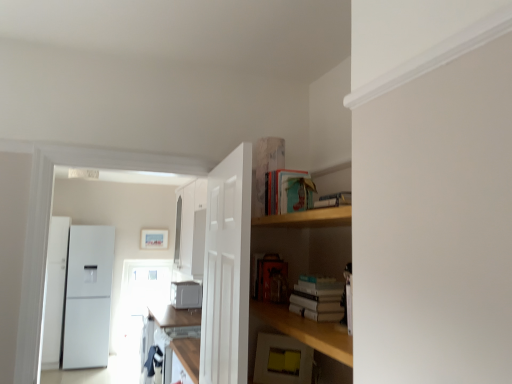
In order to face matte white cabinet at lower center, acting as the 2th cabinetry starting from the back, should I rotate leftwards or rightwards?

Rotate left and turn 10.445 degrees.

How much space does white matte book at center, which is counted as the 2th book, starting from the top, occupy horizontally?

7.42 inches.

You are a GUI agent. You are given a task and a screenshot of the screen. Output one action in this format:
    pyautogui.click(x=<x>, y=<y>)
    Task: Click on the white matte microwave at center, the first appliance ordered from the bottom
    
    Given the screenshot: What is the action you would take?
    pyautogui.click(x=186, y=295)

This screenshot has height=384, width=512. In order to click on matte wooden picture frame at upper center in this screenshot , I will do `click(154, 239)`.

Between white glossy cabinet at upper left, the first cabinetry viewed from the top, and matte wooden picture frame at upper center, which one has more height?

white glossy cabinet at upper left, the first cabinetry viewed from the top, is taller.

Does white glossy cabinet at upper left, which is the 2th cabinetry in front-to-back order, have a lesser width compared to matte wooden picture frame at upper center?

No, white glossy cabinet at upper left, which is the 2th cabinetry in front-to-back order, is not thinner than matte wooden picture frame at upper center.

Which of these two, white glossy cabinet at upper left, which is counted as the second cabinetry, starting from the bottom, or matte wooden picture frame at upper center, is bigger?

With larger size is white glossy cabinet at upper left, which is counted as the second cabinetry, starting from the bottom.

Is white glossy cabinet at upper left, which is the 2th cabinetry in front-to-back order, positioned with its back to matte wooden picture frame at upper center?

No.

From the image's perspective, is yellow matte sticky notes at lower center, placed as the second appliance when sorted from left to right, located above matte white cabinet at lower center, acting as the 2th cabinetry starting from the back?

Yes.

Is yellow matte sticky notes at lower center, which appears as the first appliance when viewed from the top, oriented away from matte white cabinet at lower center, the 2th cabinetry viewed from the top?

No, matte white cabinet at lower center, the 2th cabinetry viewed from the top, is not at the back of yellow matte sticky notes at lower center, which appears as the first appliance when viewed from the top.

Which is correct: yellow matte sticky notes at lower center, marked as the 1th appliance in a front-to-back arrangement, is inside matte white cabinet at lower center, acting as the 2th cabinetry starting from the back, or outside of it?

The correct answer is: outside.

In the scene shown: How many degrees apart are the facing directions of yellow matte sticky notes at lower center, which appears as the first appliance when viewed from the top, and matte white cabinet at lower center, acting as the 2th cabinetry starting from the back?

46.9 degrees separate the facing orientations of yellow matte sticky notes at lower center, which appears as the first appliance when viewed from the top, and matte white cabinet at lower center, acting as the 2th cabinetry starting from the back.

Which of these two, white glossy cabinet at upper left, which is the 2th cabinetry in front-to-back order, or white matte door at center, stands taller?

Standing taller between the two is white matte door at center.

Is white glossy cabinet at upper left, the first cabinetry viewed from the top, far from white matte door at center?

That's right, there is a large distance between white glossy cabinet at upper left, the first cabinetry viewed from the top, and white matte door at center.

Is white glossy cabinet at upper left, the first cabinetry viewed from the top, aimed at white matte door at center?

No, white glossy cabinet at upper left, the first cabinetry viewed from the top, is not facing towards white matte door at center.

Looking at this image, from their relative heights in the image, would you say white matte book at center, arranged as the 1th book when ordered from the bottom, is taller or shorter than white matte microwave at center, the 2th appliance positioned from the right?

Considering their sizes, white matte book at center, arranged as the 1th book when ordered from the bottom, has less height than white matte microwave at center, the 2th appliance positioned from the right.

This screenshot has height=384, width=512. Find the location of `the 2nd appliance located beneath the white matte book at center, which is counted as the 2th book, starting from the top (from a real-world perspective)`. the 2nd appliance located beneath the white matte book at center, which is counted as the 2th book, starting from the top (from a real-world perspective) is located at coordinates (186, 295).

Considering the relative positions of white matte book at center, which is counted as the 2th book, starting from the top, and white matte microwave at center, which is the first appliance from back to front, in the image provided, is white matte book at center, which is counted as the 2th book, starting from the top, to the left of white matte microwave at center, which is the first appliance from back to front, from the viewer's perspective?

Incorrect, white matte book at center, which is counted as the 2th book, starting from the top, is not on the left side of white matte microwave at center, which is the first appliance from back to front.

Looking at this image, can you tell me how much white matte book at center, which is counted as the 2th book, starting from the top, and white matte microwave at center, acting as the first appliance starting from the left, differ in facing direction?

0.000445 degrees.

Which of these two, teal matte book at upper center, which ranks as the second book in bottom-to-top order, or white matte microwave at center, the 2th appliance positioned from the right, is smaller?

With smaller size is teal matte book at upper center, which ranks as the second book in bottom-to-top order.

Is the surface of teal matte book at upper center, which ranks as the second book in bottom-to-top order, in direct contact with white matte microwave at center, the 2th appliance positioned from the right?

No.

Between point (283, 193) and point (186, 291), which one is positioned in front?

The point (283, 193) is in front.

From a real-world perspective, which object rests below the other?

In real-world perspective, white matte microwave at center, acting as the first appliance starting from the left, is lower.

In the image, is teal matte book at upper center, the 1th book viewed from the top, on the left side or the right side of yellow matte sticky notes at lower center, placed as the second appliance when sorted from left to right?

From the image, it's evident that teal matte book at upper center, the 1th book viewed from the top, is to the right of yellow matte sticky notes at lower center, placed as the second appliance when sorted from left to right.

Considering the relative sizes of teal matte book at upper center, the 1th book viewed from the top, and yellow matte sticky notes at lower center, arranged as the first appliance when viewed from the right, in the image provided, is teal matte book at upper center, the 1th book viewed from the top, shorter than yellow matte sticky notes at lower center, arranged as the first appliance when viewed from the right,?

Correct, teal matte book at upper center, the 1th book viewed from the top, is not as tall as yellow matte sticky notes at lower center, arranged as the first appliance when viewed from the right.

Considering the positions of point (279, 187) and point (263, 374), is point (279, 187) closer or farther from the camera than point (263, 374)?

Point (279, 187) is closer to the camera than point (263, 374).

Is yellow matte sticky notes at lower center, acting as the 2th appliance starting from the bottom, in front of or behind teal matte book at upper center, which ranks as the second book in bottom-to-top order, in the image?

In the image, yellow matte sticky notes at lower center, acting as the 2th appliance starting from the bottom, appears behind teal matte book at upper center, which ranks as the second book in bottom-to-top order.

From a real-world perspective, which appliance is the 1st one underneath the teal matte book at upper center, which ranks as the second book in bottom-to-top order? Please provide its 2D coordinates.

[(282, 360)]

Considering the relative sizes of yellow matte sticky notes at lower center, which appears as the first appliance when viewed from the top, and teal matte book at upper center, which ranks as the second book in bottom-to-top order, in the image provided, is yellow matte sticky notes at lower center, which appears as the first appliance when viewed from the top, shorter than teal matte book at upper center, which ranks as the second book in bottom-to-top order,?

Incorrect, the height of yellow matte sticky notes at lower center, which appears as the first appliance when viewed from the top, does not fall short of that of teal matte book at upper center, which ranks as the second book in bottom-to-top order.

Is teal matte book at upper center, which ranks as the second book in bottom-to-top order, a part of yellow matte sticky notes at lower center, acting as the 2th appliance starting from the bottom?

No, yellow matte sticky notes at lower center, acting as the 2th appliance starting from the bottom, does not contain teal matte book at upper center, which ranks as the second book in bottom-to-top order.

At what (x,y) coordinates should I click in order to perform the action: click on cabinetry located above the matte wooden picture frame at upper center (from a real-world perspective). Please return your answer as a coordinate pair (x, y). The image size is (512, 384). Looking at the image, I should click on (x=191, y=229).

Where is `cabinetry below the yellow matte sticky notes at lower center, placed as the second appliance when sorted from left to right (from a real-world perspective)`? cabinetry below the yellow matte sticky notes at lower center, placed as the second appliance when sorted from left to right (from a real-world perspective) is located at coordinates (170, 330).

When comparing their distances from matte white cabinet at lower center, the first cabinetry when ordered from front to back, does white glossy cabinet at upper left, which is counted as the 1th cabinetry, starting from the back, or matte wooden picture frame at upper center seem further?

matte wooden picture frame at upper center is positioned further to the anchor matte white cabinet at lower center, the first cabinetry when ordered from front to back.

Looking at the image, which one is located closer to yellow matte sticky notes at lower center, acting as the 2th appliance starting from the bottom, teal matte book at upper center, which ranks as the second book in bottom-to-top order, or matte white cabinet at lower center, the first cabinetry when ordered from front to back?

teal matte book at upper center, which ranks as the second book in bottom-to-top order.

Estimate the real-world distances between objects in this image. Which object is closer to white glossy cabinet at upper left, which is counted as the 1th cabinetry, starting from the back, white matte door at center or white matte book at center, which is counted as the 2th book, starting from the top?

Among the two, white matte door at center is located nearer to white glossy cabinet at upper left, which is counted as the 1th cabinetry, starting from the back.

Looking at the image, which one is located further to white matte microwave at center, which is the first appliance from back to front, white matte book at center, which is counted as the 2th book, starting from the top, or matte white cabinet at lower center, the 2th cabinetry viewed from the top?

white matte book at center, which is counted as the 2th book, starting from the top.

Based on their spatial positions, is white matte microwave at center, placed as the 2th appliance when sorted from front to back, or teal matte book at upper center, which ranks as the second book in bottom-to-top order, further from yellow matte sticky notes at lower center, acting as the 2th appliance starting from the bottom?

white matte microwave at center, placed as the 2th appliance when sorted from front to back, lies further to yellow matte sticky notes at lower center, acting as the 2th appliance starting from the bottom, than the other object.

Based on their spatial positions, is matte wooden picture frame at upper center or white matte book at center, arranged as the 1th book when ordered from the bottom, closer to yellow matte sticky notes at lower center, arranged as the first appliance when viewed from the right?

Based on the image, white matte book at center, arranged as the 1th book when ordered from the bottom, appears to be nearer to yellow matte sticky notes at lower center, arranged as the first appliance when viewed from the right.

Looking at the image, which one is located closer to matte white cabinet at lower center, acting as the 2th cabinetry starting from the back, white glossy cabinet at upper left, the first cabinetry viewed from the top, or white matte book at center, arranged as the 1th book when ordered from the bottom?

white glossy cabinet at upper left, the first cabinetry viewed from the top, lies closer to matte white cabinet at lower center, acting as the 2th cabinetry starting from the back, than the other object.

Which object lies nearer to the anchor point white matte door at center, matte white cabinet at lower center, the 2th cabinetry viewed from the top, or white glossy cabinet at upper left, which is counted as the 1th cabinetry, starting from the back?

Based on the image, matte white cabinet at lower center, the 2th cabinetry viewed from the top, appears to be nearer to white matte door at center.

You are a GUI agent. You are given a task and a screenshot of the screen. Output one action in this format:
    pyautogui.click(x=<x>, y=<y>)
    Task: Click on the appliance between matte white cabinet at lower center, the 2th cabinetry viewed from the top, and matte wooden picture frame at upper center, along the z-axis
    Image resolution: width=512 pixels, height=384 pixels.
    Given the screenshot: What is the action you would take?
    pyautogui.click(x=186, y=295)

Find the location of `cabinetry between white matte door at center and white glossy cabinet at upper left, which is counted as the 1th cabinetry, starting from the back, in the front-back direction`. cabinetry between white matte door at center and white glossy cabinet at upper left, which is counted as the 1th cabinetry, starting from the back, in the front-back direction is located at coordinates (170, 330).

Locate an element on the screen. appliance positioned between white matte book at center, which is counted as the 2th book, starting from the top, and white glossy cabinet at upper left, the first cabinetry viewed from the top, from near to far is located at coordinates (282, 360).

Locate an element on the screen. appliance positioned between white glossy cabinet at upper left, which is counted as the 1th cabinetry, starting from the back, and matte wooden picture frame at upper center from near to far is located at coordinates (186, 295).